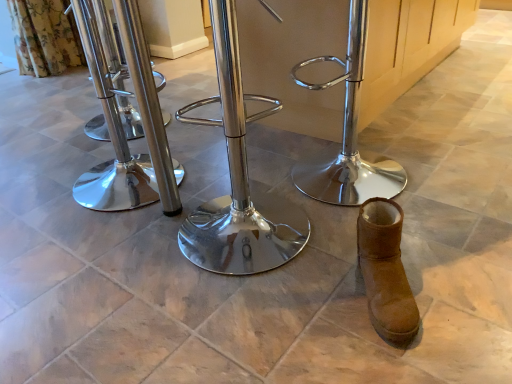
Where is `vacant location behind brown suede boot at lower right`? Image resolution: width=512 pixels, height=384 pixels. vacant location behind brown suede boot at lower right is located at coordinates (352, 244).